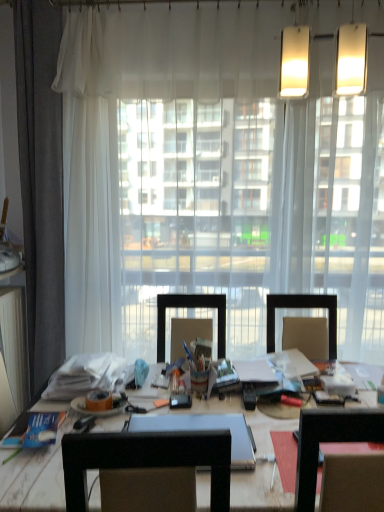
What do you see at coordinates (35, 478) in the screenshot? This screenshot has height=512, width=384. I see `wooden desk at center` at bounding box center [35, 478].

You are a GUI agent. You are given a task and a screenshot of the screen. Output one action in this format:
    pyautogui.click(x=<x>, y=<y>)
    Task: Click on the orange matte adhesive tape at center
    The width and height of the screenshot is (384, 512).
    Given the screenshot: What is the action you would take?
    pyautogui.click(x=98, y=401)

The image size is (384, 512). What are the coordinates of `wooden desk at center` in the screenshot? It's located at (35, 478).

Consider the image. Considering the sizes of wooden desk at center and orange matte adhesive tape at center in the image, is wooden desk at center bigger or smaller than orange matte adhesive tape at center?

wooden desk at center is bigger than orange matte adhesive tape at center.

From a real-world perspective, between wooden desk at center and orange matte adhesive tape at center, who is vertically lower?

In real-world perspective, wooden desk at center is lower.

Does point (88, 473) come farther from viewer compared to point (96, 403)?

No, it is not.

Is blue paper book at lower left at the right side of orange matte adhesive tape at center?

No, blue paper book at lower left is not to the right of orange matte adhesive tape at center.

From a real-world perspective, is blue paper book at lower left positioned above or below orange matte adhesive tape at center?

blue paper book at lower left is situated lower than orange matte adhesive tape at center in the real world.

Could you tell me if blue paper book at lower left is facing orange matte adhesive tape at center?

No, blue paper book at lower left is not facing towards orange matte adhesive tape at center.

In terms of height, does blue paper book at lower left look taller or shorter compared to orange matte adhesive tape at center?

Considering their sizes, blue paper book at lower left has less height than orange matte adhesive tape at center.

From the image's perspective, who appears lower, orange matte adhesive tape at center or wooden desk at center?

From the image's view, wooden desk at center is below.

Which of these two, orange matte adhesive tape at center or wooden desk at center, stands taller?

wooden desk at center is taller.

Is orange matte adhesive tape at center positioned far away from wooden desk at center?

No.

Is blue paper book at lower left thinner than wooden desk at center?

Correct, the width of blue paper book at lower left is less than that of wooden desk at center.

From the image's perspective, is blue paper book at lower left below wooden desk at center?

No.

Which is correct: blue paper book at lower left is inside wooden desk at center, or outside of it?

blue paper book at lower left is located inside wooden desk at center.

Does blue paper book at lower left have a lesser height compared to wooden desk at center?

Yes, blue paper book at lower left is shorter than wooden desk at center.

Based on the photo, from the image's perspective, between wooden desk at center and blue paper book at lower left, which one is located above?

blue paper book at lower left, from the image's perspective.

Considering the relative sizes of wooden desk at center and blue paper book at lower left in the image provided, is wooden desk at center shorter than blue paper book at lower left?

Incorrect, the height of wooden desk at center does not fall short of that of blue paper book at lower left.

Is wooden desk at center closer to camera compared to blue paper book at lower left?

Yes, wooden desk at center is in front of blue paper book at lower left.

Does wooden desk at center have a lesser width compared to blue paper book at lower left?

No.

From the image's perspective, is orange matte adhesive tape at center on top of blue paper book at lower left?

Correct, orange matte adhesive tape at center appears higher than blue paper book at lower left in the image.

From a real-world perspective, is orange matte adhesive tape at center positioned over blue paper book at lower left based on gravity?

Yes, from a real-world perspective, orange matte adhesive tape at center is over blue paper book at lower left

Which is farther from the camera, [111,404] or [24,443]?

The point [111,404] is farther from the camera.

Would you say orange matte adhesive tape at center is to the left or to the right of blue paper book at lower left in the picture?

orange matte adhesive tape at center is positioned on blue paper book at lower left's right side.

At what (x,y) coordinates should I click in order to perform the action: click on adhesive tape on the left of wooden desk at center. Please return your answer as a coordinate pair (x, y). This screenshot has width=384, height=512. Looking at the image, I should click on (98, 401).

What are the coordinates of `adhesive tape above the blue paper book at lower left (from a real-world perspective)` in the screenshot? It's located at (98, 401).

Based on the photo, which object lies nearer to the anchor point orange matte adhesive tape at center, wooden desk at center or blue paper book at lower left?

blue paper book at lower left lies closer to orange matte adhesive tape at center than the other object.

Which object lies nearer to the anchor point orange matte adhesive tape at center, blue paper book at lower left or wooden desk at center?

Among the two, blue paper book at lower left is located nearer to orange matte adhesive tape at center.

Based on their spatial positions, is orange matte adhesive tape at center or blue paper book at lower left closer to wooden desk at center?

blue paper book at lower left is closer to wooden desk at center.

When comparing their distances from blue paper book at lower left, does wooden desk at center or orange matte adhesive tape at center seem closer?

wooden desk at center is closer to blue paper book at lower left.

Estimate the real-world distances between objects in this image. Which object is closer to blue paper book at lower left, orange matte adhesive tape at center or wooden desk at center?

wooden desk at center.

Based on their spatial positions, is blue paper book at lower left or orange matte adhesive tape at center closer to wooden desk at center?

The object closer to wooden desk at center is blue paper book at lower left.

You are a GUI agent. You are given a task and a screenshot of the screen. Output one action in this format:
    pyautogui.click(x=<x>, y=<y>)
    Task: Click on the adhesive tape situated between blue paper book at lower left and wooden desk at center from left to right
    The height and width of the screenshot is (512, 384).
    Given the screenshot: What is the action you would take?
    pyautogui.click(x=98, y=401)